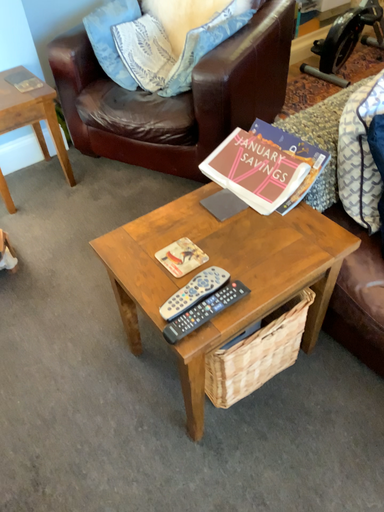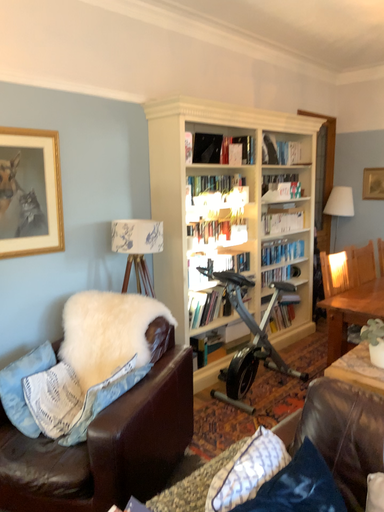
Question: Which way did the camera rotate in the video?

Choices:
 (A) rotated downward
 (B) rotated upward

Answer: (B)